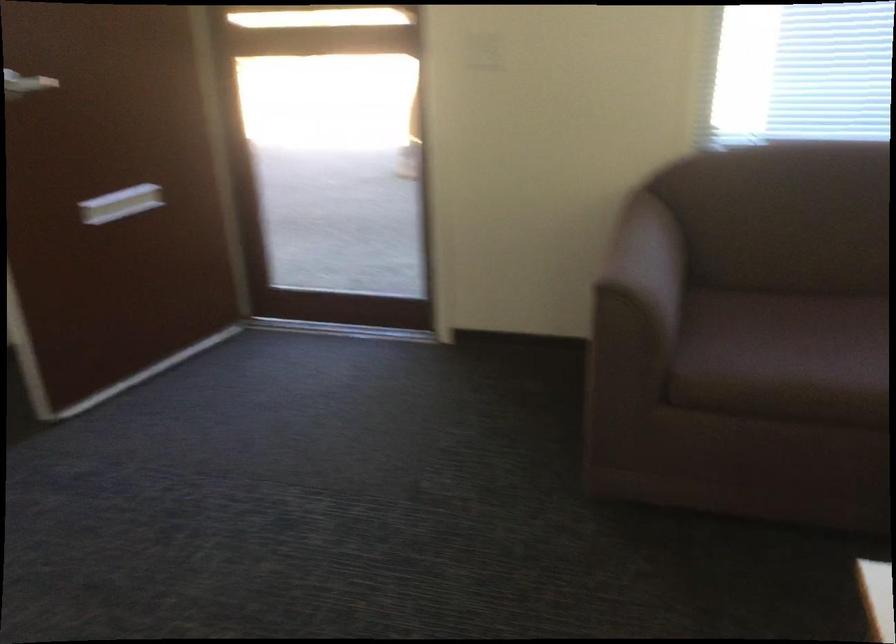
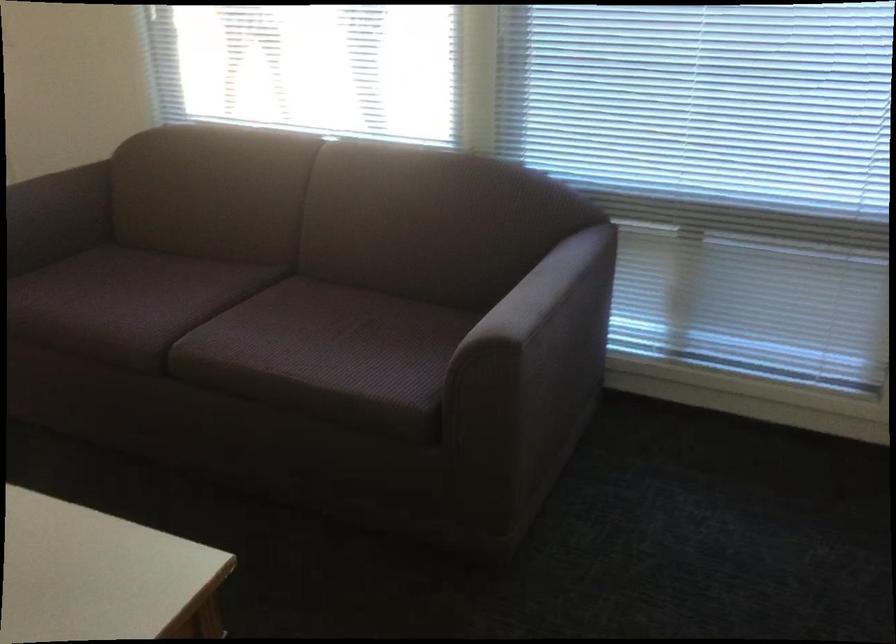
Find the pixel in the second image that matches point (661, 257) in the first image.

(56, 216)